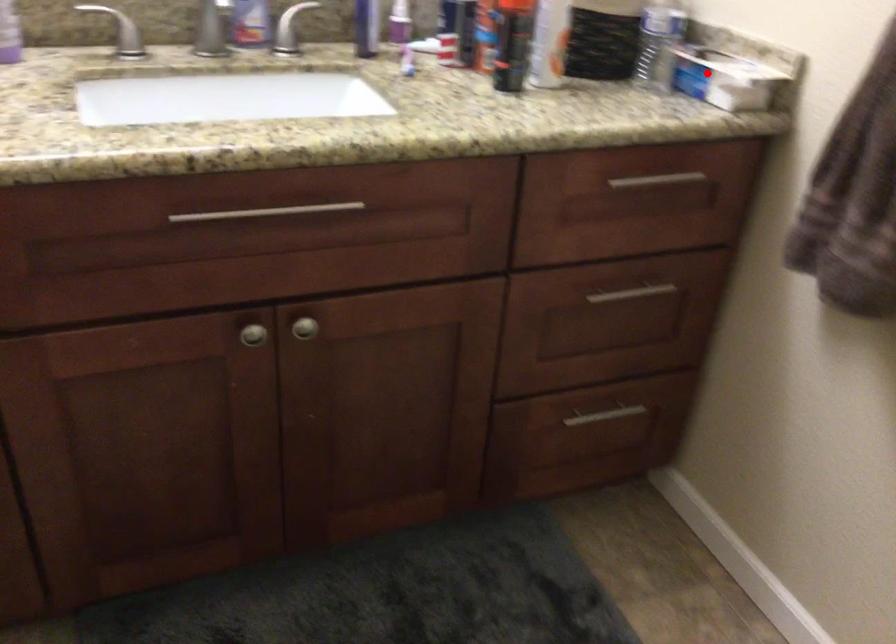
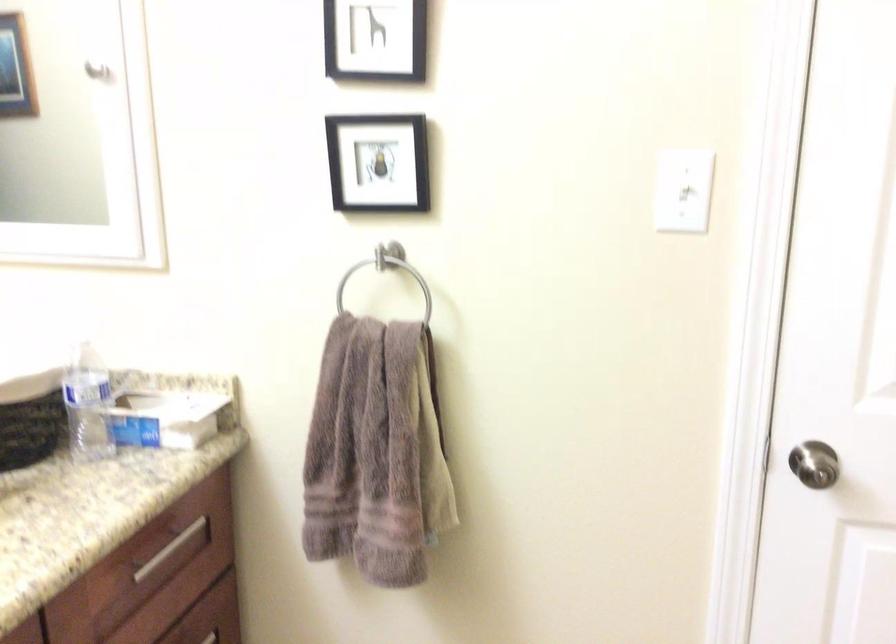
Locate, in the second image, the point that corresponds to the highlighted location in the first image.

(165, 418)